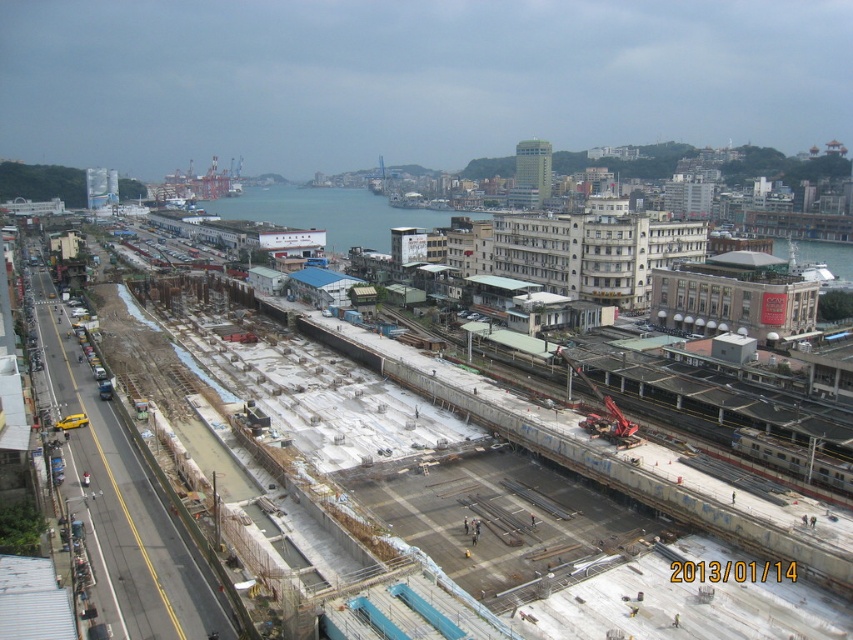
Question: Which point is closer to the camera?

Choices:
 (A) (306, 440)
 (B) (297, 188)

Answer: (A)

Question: Which object is closer to the camera taking this photo?

Choices:
 (A) concrete at center
 (B) blue water at center

Answer: (A)

Question: Which of the following is the farthest from the observer?

Choices:
 (A) coord(280,477)
 (B) coord(389,212)

Answer: (B)

Question: Where is concrete at center located in relation to blue water at center in the image?

Choices:
 (A) below
 (B) above

Answer: (A)

Question: Is concrete at center thinner than blue water at center?

Choices:
 (A) no
 (B) yes

Answer: (B)

Question: Can you confirm if concrete at center is bigger than blue water at center?

Choices:
 (A) no
 (B) yes

Answer: (A)